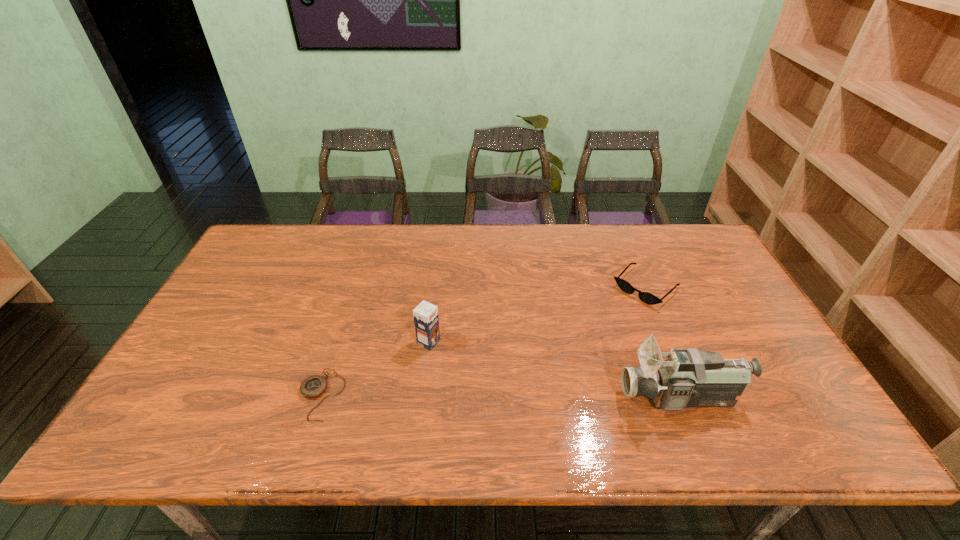
The height and width of the screenshot is (540, 960). I want to click on vacant space that satisfies the following two spatial constraints: 1. on the front side of the camcorder; 2. on the front-facing side of the pocket watch, so click(x=321, y=397).

Where is `vacant space that satisfies the following two spatial constraints: 1. on the front side of the tallest object; 2. on the front-facing side of the shortest object`? The width and height of the screenshot is (960, 540). vacant space that satisfies the following two spatial constraints: 1. on the front side of the tallest object; 2. on the front-facing side of the shortest object is located at coordinates (321, 397).